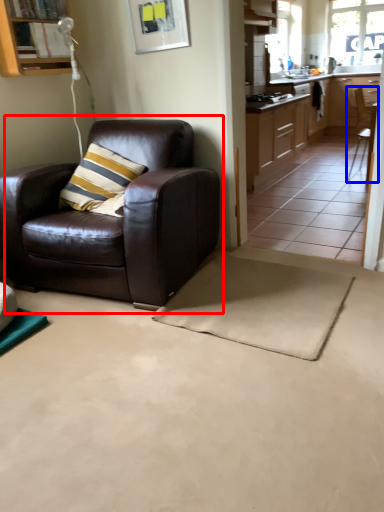
Question: Among these objects, which one is farthest to the camera, chair (highlighted by a red box) or chair (highlighted by a blue box)?

Choices:
 (A) chair
 (B) chair

Answer: (B)